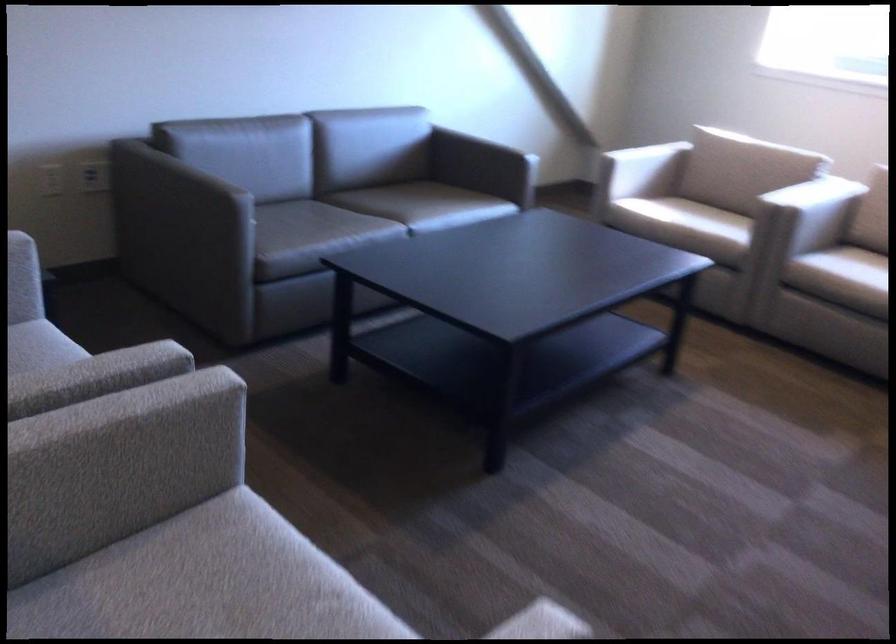
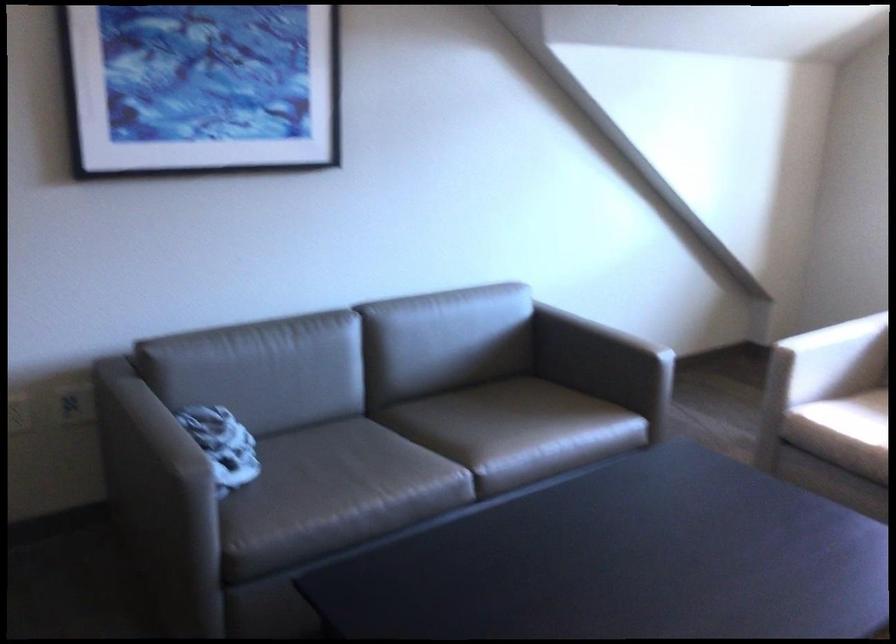
In the second image, find the point that corresponds to point (641, 167) in the first image.

(831, 359)